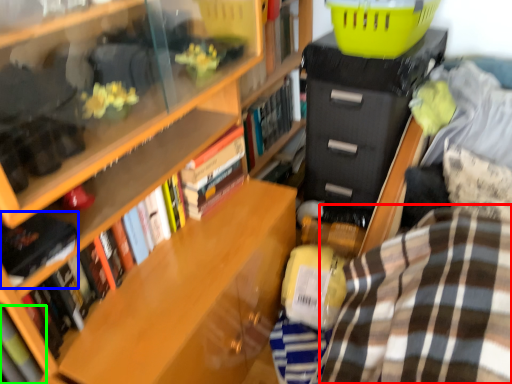
Question: Which object is positioned farthest from plaid (highlighted by a red box)? Select from book (highlighted by a blue box) and book (highlighted by a green box).

Choices:
 (A) book
 (B) book

Answer: (B)